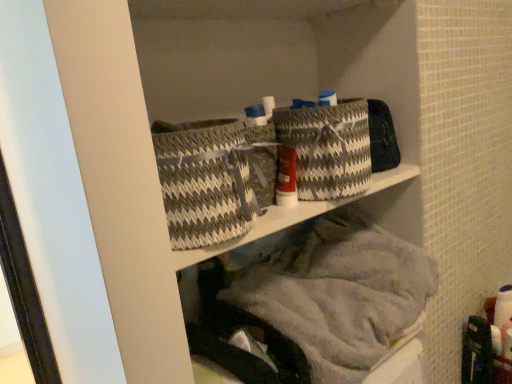
Question: Considering the relative positions of gray and white woven basket at center, which ranks as the second basket in left-to-right order, and gray woven baskets at upper center in the image provided, is gray and white woven basket at center, which ranks as the second basket in left-to-right order, to the left of gray woven baskets at upper center from the viewer's perspective?

Choices:
 (A) no
 (B) yes

Answer: (A)

Question: Does gray and white woven basket at center, which ranks as the second basket in left-to-right order, have a lesser height compared to gray woven baskets at upper center?

Choices:
 (A) no
 (B) yes

Answer: (B)

Question: Is gray and white woven basket at center, which ranks as the second basket in left-to-right order, aimed at gray woven baskets at upper center?

Choices:
 (A) no
 (B) yes

Answer: (A)

Question: Would you say gray woven baskets at upper center is part of gray and white woven basket at center, which is the first basket from right to left,'s contents?

Choices:
 (A) yes
 (B) no

Answer: (B)

Question: From the image's perspective, would you say gray and white woven basket at center, which is the first basket from right to left, is positioned over gray woven baskets at upper center?

Choices:
 (A) yes
 (B) no

Answer: (A)

Question: Considering the relative sizes of gray and white woven basket at center, which is the first basket from right to left, and gray woven baskets at upper center in the image provided, is gray and white woven basket at center, which is the first basket from right to left, taller than gray woven baskets at upper center?

Choices:
 (A) yes
 (B) no

Answer: (B)

Question: From a real-world perspective, is gray woven baskets at upper center physically below gray and white woven basket at center, which is the first basket from right to left?

Choices:
 (A) yes
 (B) no

Answer: (A)

Question: From a real-world perspective, is gray woven baskets at upper center positioned over gray and white woven basket at center, which ranks as the second basket in left-to-right order, based on gravity?

Choices:
 (A) yes
 (B) no

Answer: (B)

Question: Considering the relative sizes of gray woven baskets at upper center and gray and white woven basket at center, which ranks as the second basket in left-to-right order, in the image provided, is gray woven baskets at upper center wider than gray and white woven basket at center, which ranks as the second basket in left-to-right order,?

Choices:
 (A) yes
 (B) no

Answer: (A)

Question: Can you confirm if gray woven baskets at upper center is taller than gray and white woven basket at center, which ranks as the second basket in left-to-right order?

Choices:
 (A) no
 (B) yes

Answer: (B)

Question: Does gray woven baskets at upper center have a smaller size compared to gray and white woven basket at center, which ranks as the second basket in left-to-right order?

Choices:
 (A) no
 (B) yes

Answer: (A)

Question: From the image's perspective, is gray woven baskets at upper center below gray and white woven basket at center, which ranks as the second basket in left-to-right order?

Choices:
 (A) no
 (B) yes

Answer: (B)

Question: From a real-world perspective, is gray and white woven basket at center, which is the first basket from right to left, on top of gray woven basket at center, the second basket positioned from the right?

Choices:
 (A) yes
 (B) no

Answer: (A)